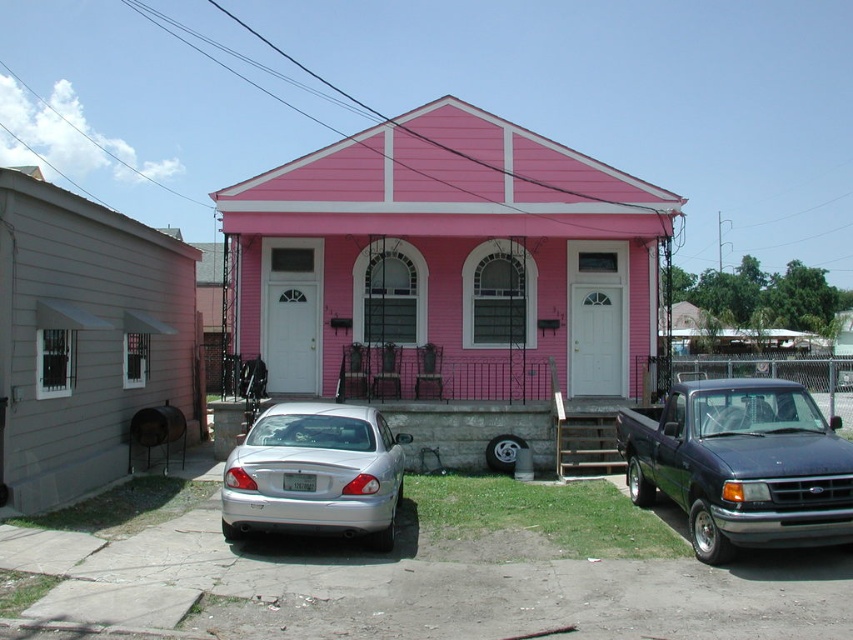
Can you confirm if metallic blue truck at right is bigger than silver metallic sedan at lower center?

Indeed, metallic blue truck at right has a larger size compared to silver metallic sedan at lower center.

Is the position of metallic blue truck at right more distant than that of silver metallic sedan at lower center?

No, it is not.

I want to click on metallic blue truck at right, so click(741, 465).